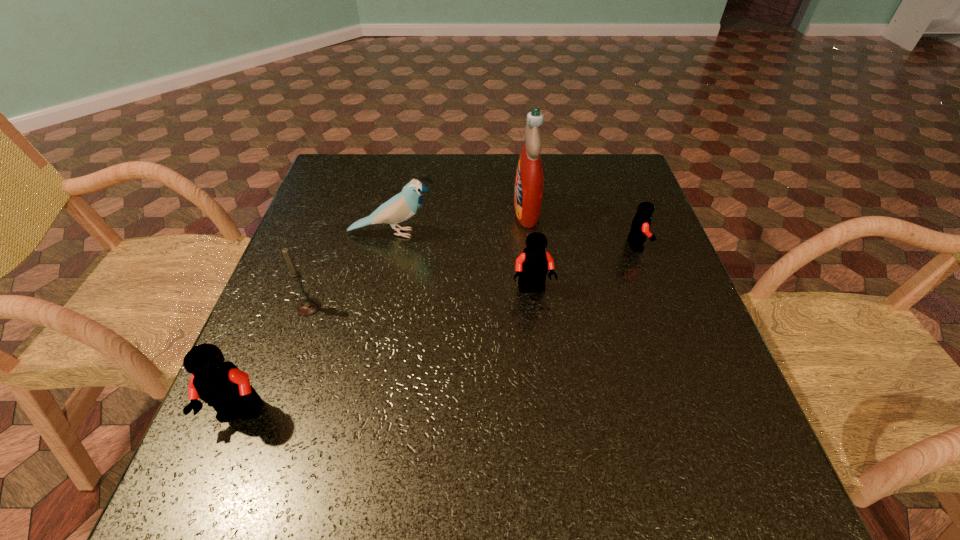
I want to click on object present at the right edge, so click(640, 226).

At what (x,y) coordinates should I click in order to perform the action: click on object situated at the near left corner. Please return your answer as a coordinate pair (x, y). The height and width of the screenshot is (540, 960). Looking at the image, I should click on (219, 383).

Locate an element on the screen. The width and height of the screenshot is (960, 540). vacant space at the near edge of the desktop is located at coordinates (368, 396).

In the image, there is a desktop. Where is `vacant space at the left edge`? vacant space at the left edge is located at coordinates (303, 381).

I want to click on free spot at the right edge of the desktop, so click(659, 249).

Find the location of `free space at the far left corner`. free space at the far left corner is located at coordinates (358, 156).

I want to click on vacant space at the near left corner of the desktop, so click(x=285, y=405).

Locate an element on the screen. free space at the far right corner of the desktop is located at coordinates (641, 188).

This screenshot has width=960, height=540. Identify the location of free space at the near right corner of the desktop. (670, 420).

Locate an element on the screen. The image size is (960, 540). vacant region between the nearest Lego and the bird is located at coordinates (317, 324).